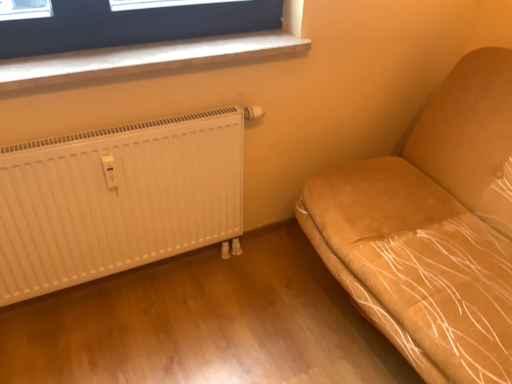
Question: Considering the relative sizes of suede-like tan sofa at right and white ribbed radiator at lower left in the image provided, is suede-like tan sofa at right bigger than white ribbed radiator at lower left?

Choices:
 (A) no
 (B) yes

Answer: (B)

Question: Is suede-like tan sofa at right next to white ribbed radiator at lower left and touching it?

Choices:
 (A) no
 (B) yes

Answer: (A)

Question: Is suede-like tan sofa at right in front of white ribbed radiator at lower left?

Choices:
 (A) yes
 (B) no

Answer: (A)

Question: Is suede-like tan sofa at right to the left of white ribbed radiator at lower left from the viewer's perspective?

Choices:
 (A) no
 (B) yes

Answer: (A)

Question: Can you confirm if suede-like tan sofa at right is thinner than white ribbed radiator at lower left?

Choices:
 (A) no
 (B) yes

Answer: (A)

Question: Can you confirm if suede-like tan sofa at right is smaller than white ribbed radiator at lower left?

Choices:
 (A) yes
 (B) no

Answer: (B)

Question: Is white ribbed radiator at lower left closer to camera compared to suede-like tan sofa at right?

Choices:
 (A) no
 (B) yes

Answer: (A)

Question: From a real-world perspective, is white ribbed radiator at lower left over suede-like tan sofa at right?

Choices:
 (A) yes
 (B) no

Answer: (B)

Question: Is white ribbed radiator at lower left not within suede-like tan sofa at right?

Choices:
 (A) yes
 (B) no

Answer: (A)

Question: Can you confirm if white ribbed radiator at lower left is shorter than suede-like tan sofa at right?

Choices:
 (A) yes
 (B) no

Answer: (A)

Question: Does white ribbed radiator at lower left come behind suede-like tan sofa at right?

Choices:
 (A) no
 (B) yes

Answer: (B)

Question: Does white ribbed radiator at lower left have a larger size compared to suede-like tan sofa at right?

Choices:
 (A) no
 (B) yes

Answer: (A)

Question: Does white plastic window sill at upper left have a larger size compared to suede-like tan sofa at right?

Choices:
 (A) yes
 (B) no

Answer: (B)